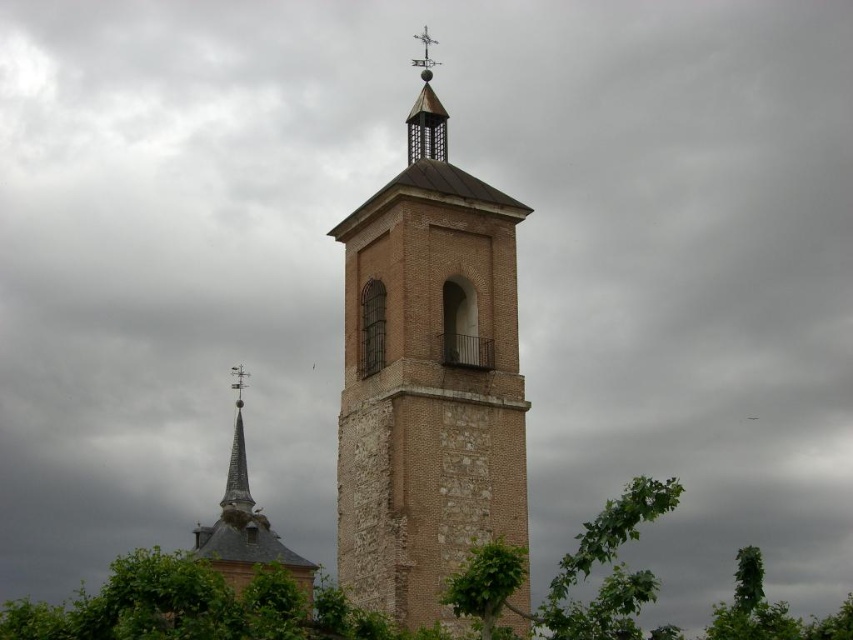
Can you confirm if brick tower at center is positioned below smooth gray spire at center?

No.

Does brick tower at center appear over smooth gray spire at center?

Yes.

Which is in front, point (364, 449) or point (225, 476)?

Positioned in front is point (364, 449).

Locate an element on the screen. The width and height of the screenshot is (853, 640). brick tower at center is located at coordinates (427, 378).

In the scene shown: Is smooth brick steeple at center further to camera compared to smooth gray spire at center?

That is False.

Is smooth brick steeple at center to the right of smooth gray spire at center from the viewer's perspective?

Indeed, smooth brick steeple at center is positioned on the right side of smooth gray spire at center.

Looking at this image, who is more forward, (x=236, y=429) or (x=236, y=472)?

Point (x=236, y=472)

The image size is (853, 640). I want to click on smooth brick steeple at center, so click(x=247, y=524).

From the picture: Which of these two, brick tower at center or smooth brick steeple at center, stands shorter?

Standing shorter between the two is smooth brick steeple at center.

Which of these two, brick tower at center or smooth brick steeple at center, stands taller?

With more height is brick tower at center.

You are a GUI agent. You are given a task and a screenshot of the screen. Output one action in this format:
    pyautogui.click(x=<x>, y=<y>)
    Task: Click on the brick tower at center
    The width and height of the screenshot is (853, 640).
    Given the screenshot: What is the action you would take?
    pyautogui.click(x=427, y=378)

The height and width of the screenshot is (640, 853). Find the location of `brick tower at center`. brick tower at center is located at coordinates point(427,378).